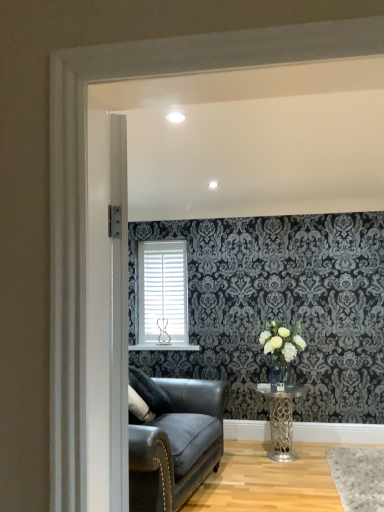
At what (x,y) coordinates should I click in order to perform the action: click on free point in front of metallic silver table at lower center. Please return your answer as a coordinate pair (x, y). The image size is (384, 512). Looking at the image, I should click on (270, 482).